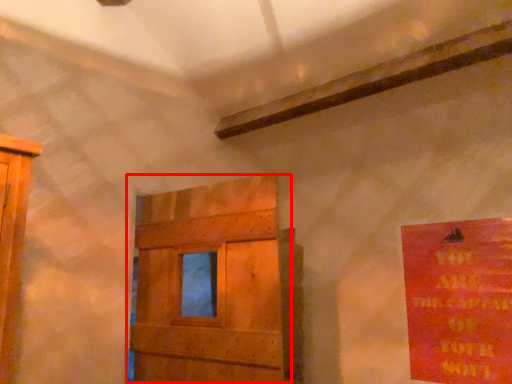
Question: From the image, what is the correct spatial relationship of door (annotated by the red box) in relation to poster?

Choices:
 (A) right
 (B) left

Answer: (B)